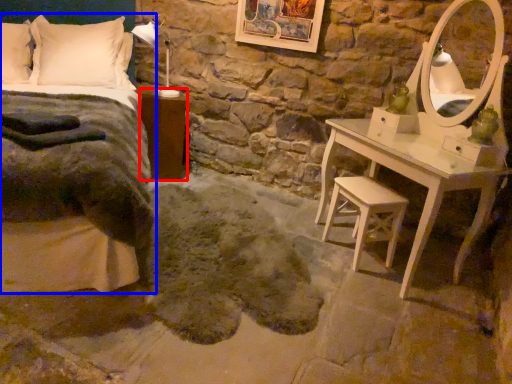
Question: Among these objects, which one is farthest to the camera, nightstand (highlighted by a red box) or bed (highlighted by a blue box)?

Choices:
 (A) nightstand
 (B) bed

Answer: (A)